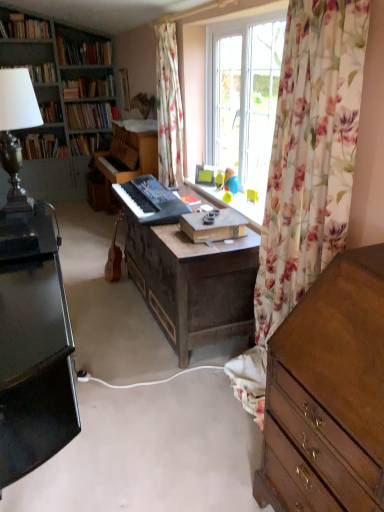
Locate an element on the screen. Image resolution: width=384 pixels, height=512 pixels. vacant area that lies between wooden desk at center and floral fabric curtain at right, placed as the second curtain when sorted from left to right is located at coordinates (211, 391).